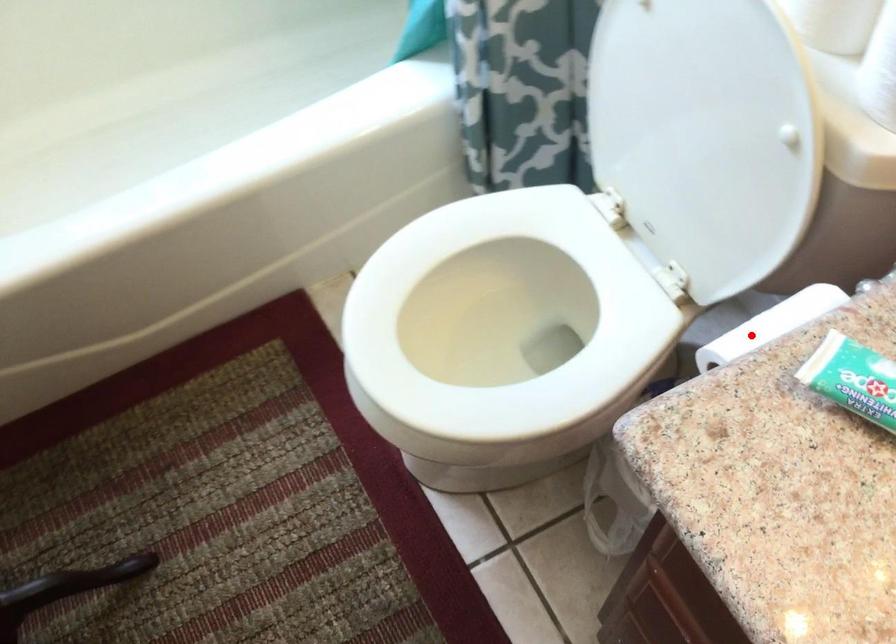
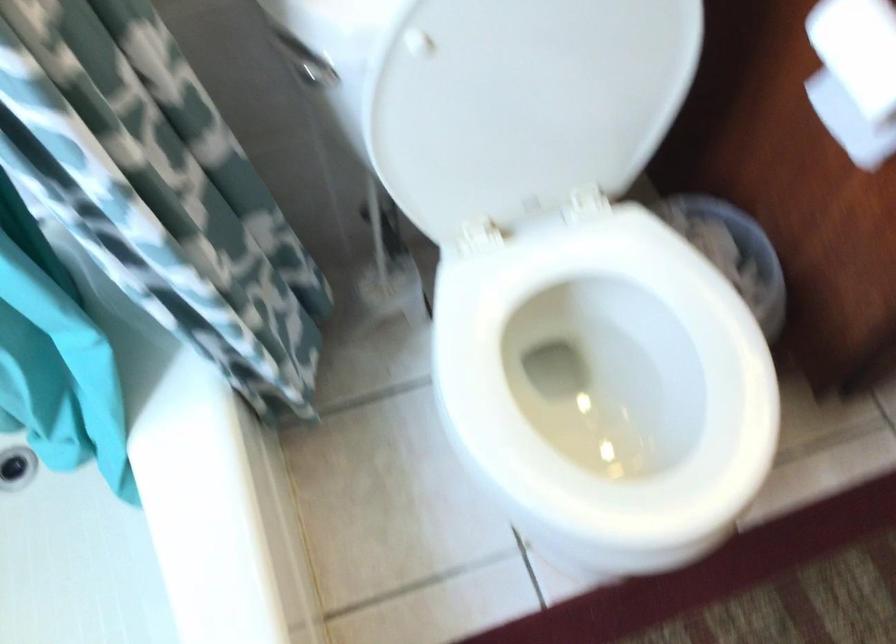
Question: I am providing you with two images of the same scene from different viewpoints. Given a red point in image1, look at the same physical point in image2. Is it:

Choices:
 (A) Closer to the viewpoint
 (B) Farther from the viewpoint

Answer: (B)